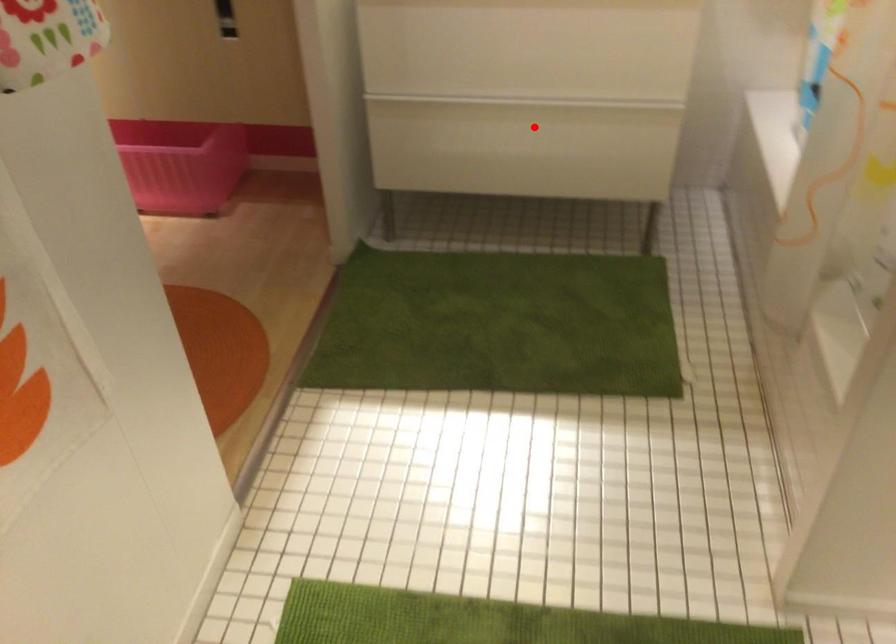
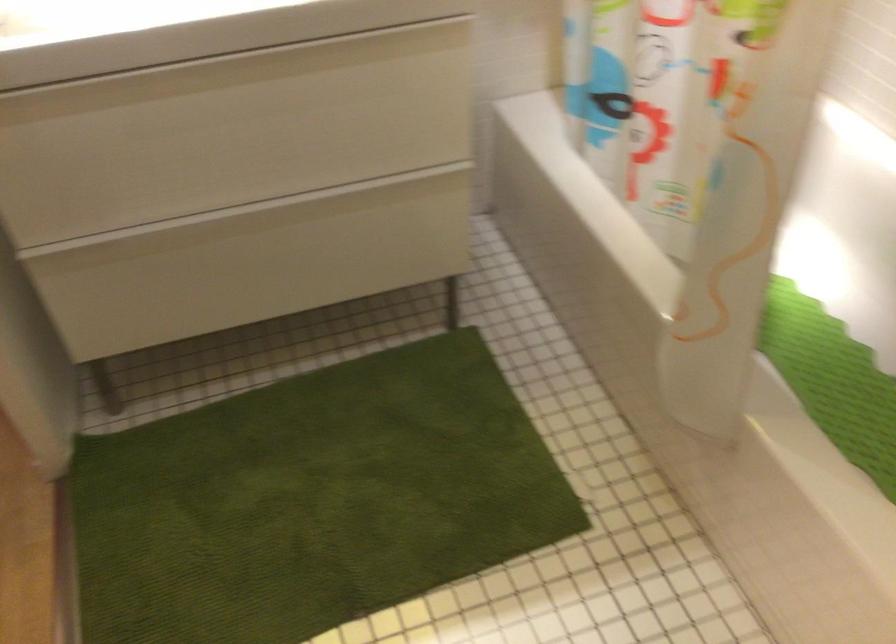
Question: I am providing you with two images of the same scene from different viewpoints. Image1 has a red point marked. In image2, the corresponding 3D location appears at what relative position? Reply with the corresponding letter.

Choices:
 (A) Closer
 (B) Farther

Answer: (A)